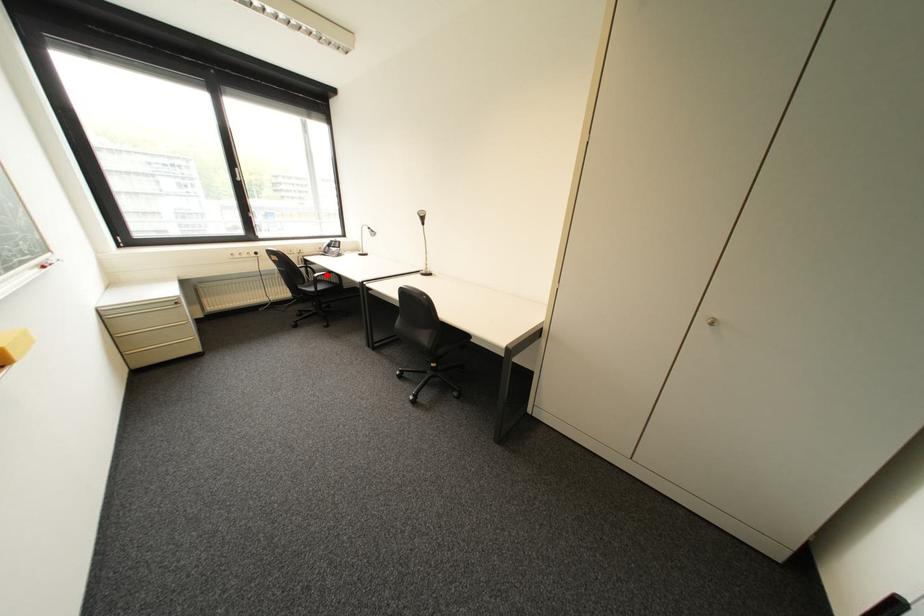
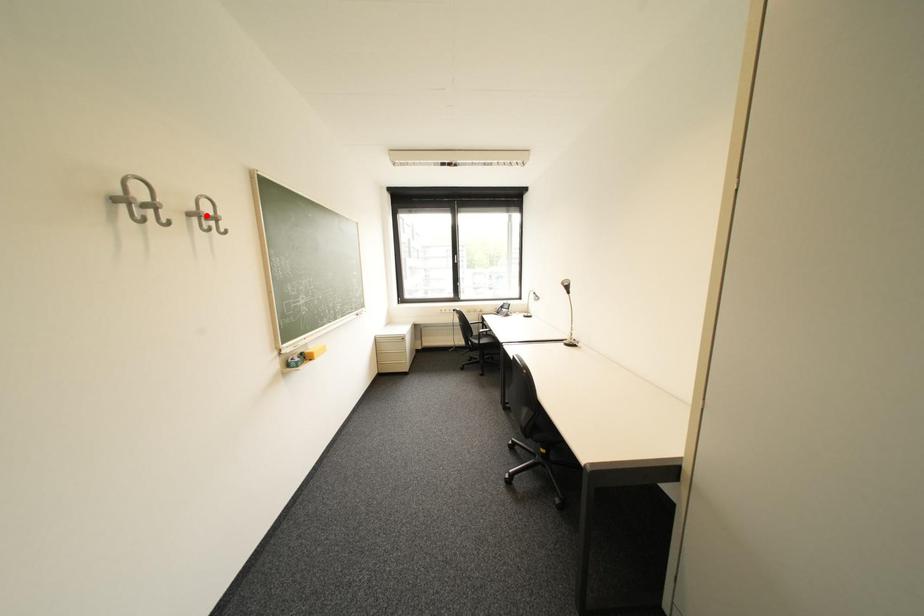
I am providing you with two images of the same scene from different viewpoints. A red point is marked on the first image and another point is marked on the second image. Are the points marked in image1 and image2 representing the same 3D position?

No